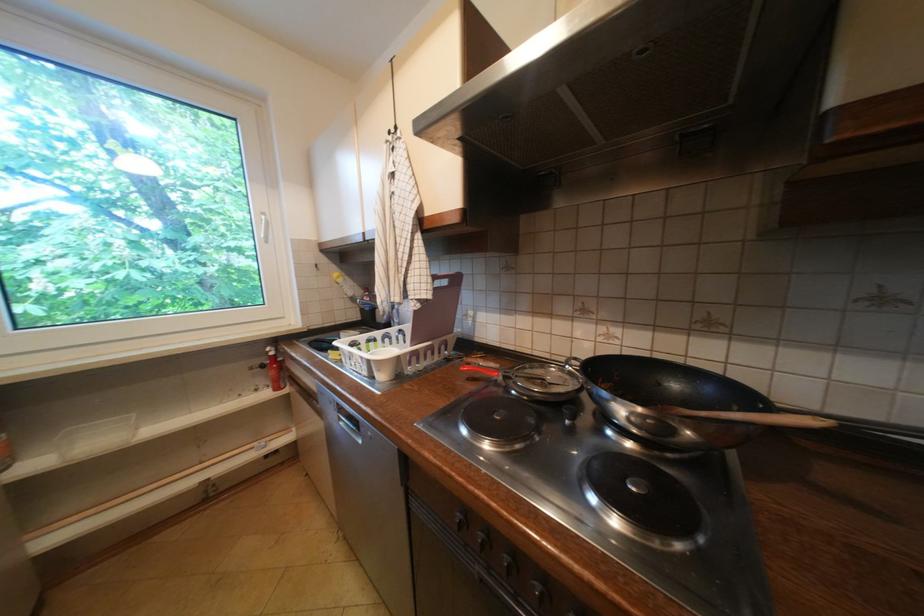
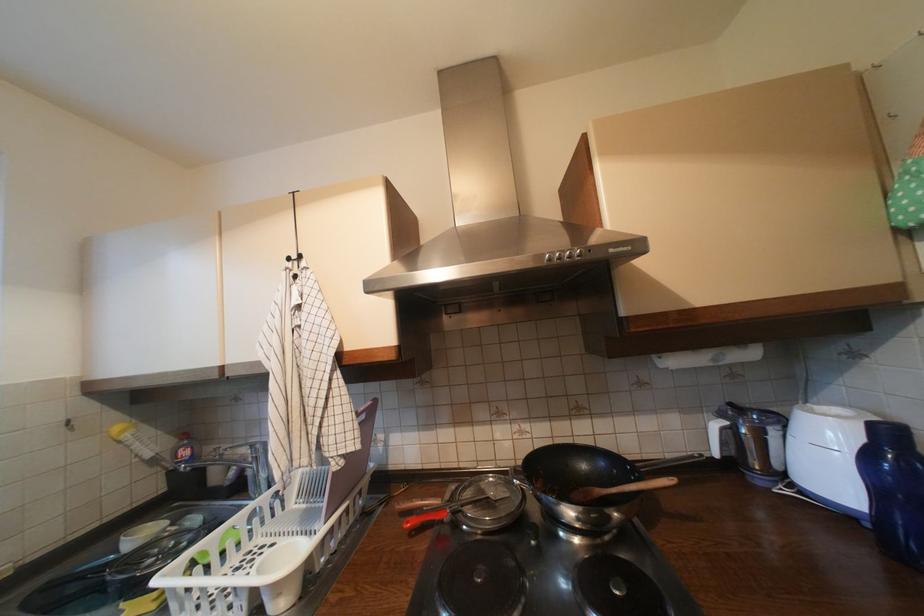
The point at (475, 360) is marked in the first image. Where is the corresponding point in the second image?

(407, 506)